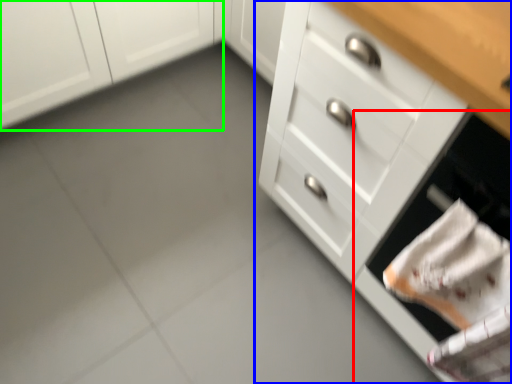
Question: Estimate the real-world distances between objects in this image. Which object is closer to oven (highlighted by a red box), chest of drawers (highlighted by a blue box) or cabinetry (highlighted by a green box)?

Choices:
 (A) chest of drawers
 (B) cabinetry

Answer: (A)